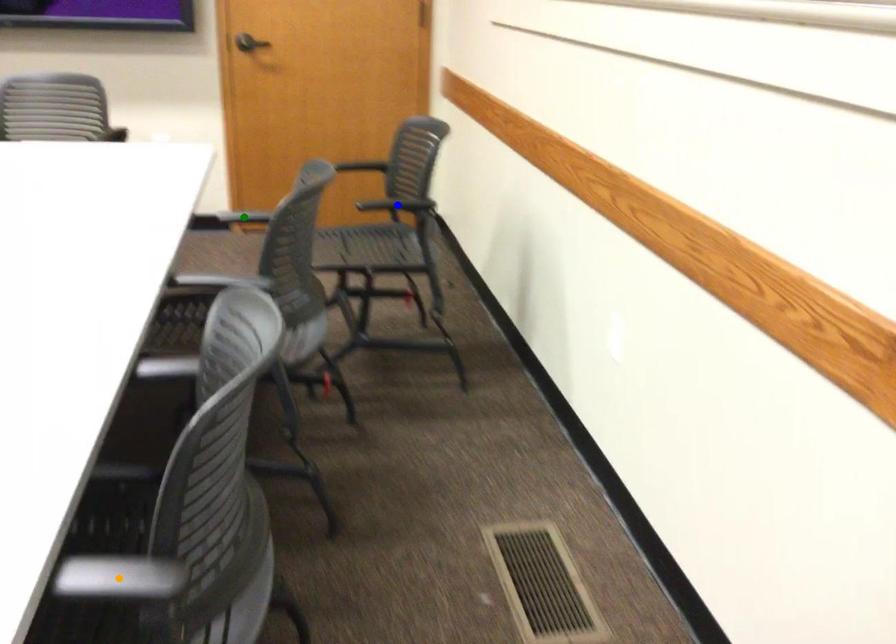
Order these from nearest to farthest:
blue point, green point, orange point

orange point
blue point
green point